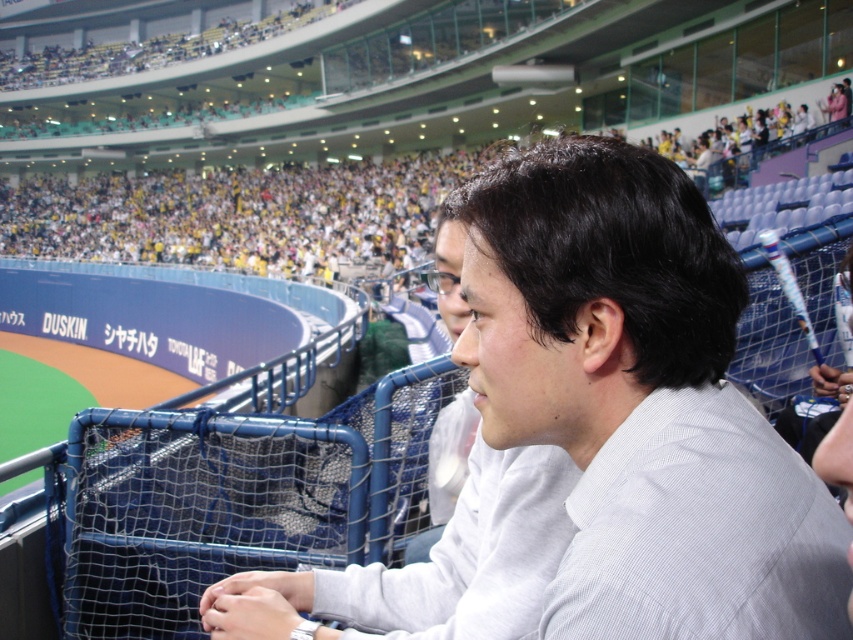
Question: Which point is farther to the camera?

Choices:
 (A) pyautogui.click(x=494, y=625)
 (B) pyautogui.click(x=553, y=340)

Answer: (A)

Question: Does white textured shirt at center appear on the right side of white cotton shirt at center?

Choices:
 (A) yes
 (B) no

Answer: (A)

Question: Which of the following is the closest to the observer?

Choices:
 (A) white textured shirt at center
 (B) white cotton shirt at center

Answer: (A)

Question: Can you confirm if white textured shirt at center is thinner than white cotton shirt at center?

Choices:
 (A) no
 (B) yes

Answer: (B)

Question: From the image, what is the correct spatial relationship of white textured shirt at center in relation to white cotton shirt at center?

Choices:
 (A) right
 (B) left

Answer: (A)